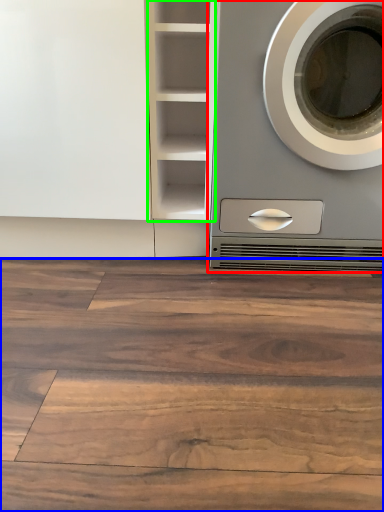
Question: Which is nearer to the washing machine (highlighted by a red box)? hardwood (highlighted by a blue box) or cabinet (highlighted by a green box).

Choices:
 (A) hardwood
 (B) cabinet

Answer: (B)